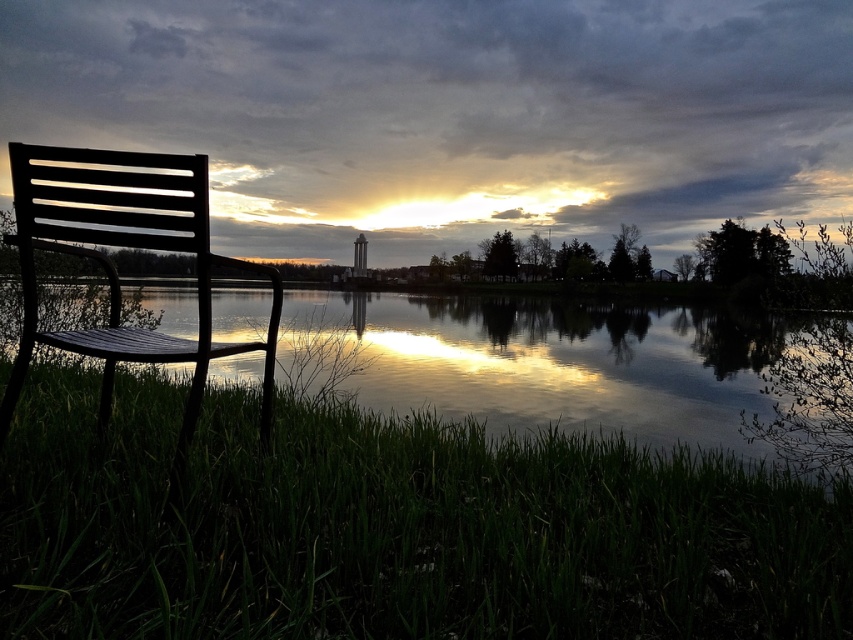
Question: Among these points, which one is nearest to the camera?

Choices:
 (A) (202, 170)
 (B) (287, 330)

Answer: (A)

Question: Which object is the closest to the green grass at lower left?

Choices:
 (A) black metal chair at left
 (B) glossy water at chair left

Answer: (A)

Question: Is green grass at lower left positioned behind glossy water at chair left?

Choices:
 (A) no
 (B) yes

Answer: (A)

Question: Estimate the real-world distances between objects in this image. Which object is farther from the green grass at lower left?

Choices:
 (A) black metal chair at left
 (B) glossy water at chair left

Answer: (B)

Question: Can you confirm if glossy water at chair left is positioned above black metal chair at left?

Choices:
 (A) yes
 (B) no

Answer: (A)

Question: Observing the image, what is the correct spatial positioning of green grass at lower left in reference to black metal chair at left?

Choices:
 (A) right
 (B) left

Answer: (A)